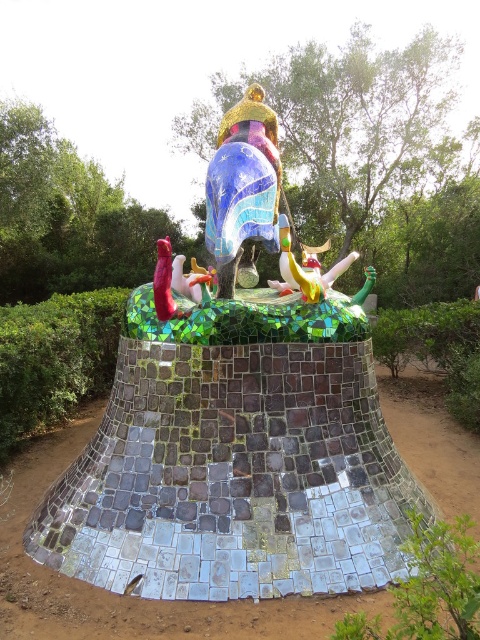
Question: Which object appears closest to the camera in this image?

Choices:
 (A) mosaic mosaic horse at center
 (B) shiny yellow and green toy at center

Answer: (A)

Question: In this image, where is mosaic mosaic horse at center located relative to shiny yellow and green toy at center?

Choices:
 (A) right
 (B) left

Answer: (B)

Question: Is mosaic mosaic horse at center to the left of shiny yellow and green toy at center from the viewer's perspective?

Choices:
 (A) no
 (B) yes

Answer: (B)

Question: Does mosaic mosaic horse at center have a greater width compared to shiny yellow and green toy at center?

Choices:
 (A) no
 (B) yes

Answer: (A)